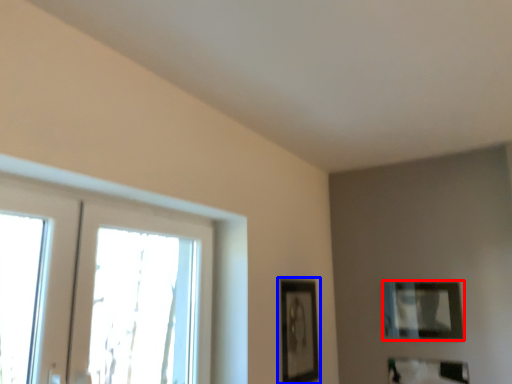
Question: Which object is closer to the camera taking this photo, picture frame (highlighted by a red box) or picture frame (highlighted by a blue box)?

Choices:
 (A) picture frame
 (B) picture frame

Answer: (B)